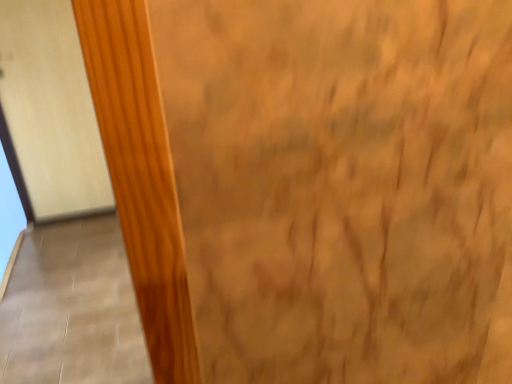
In order to face wooden elevator door at left, should I rotate leftwards or rightwards?

You should rotate left by 25.308 degrees.

The width and height of the screenshot is (512, 384). Describe the element at coordinates (51, 109) in the screenshot. I see `wooden elevator door at left` at that location.

The width and height of the screenshot is (512, 384). What are the coordinates of `wooden elevator door at left` in the screenshot? It's located at (51, 109).

Locate an element on the screen. The image size is (512, 384). wooden elevator door at left is located at coordinates (51, 109).